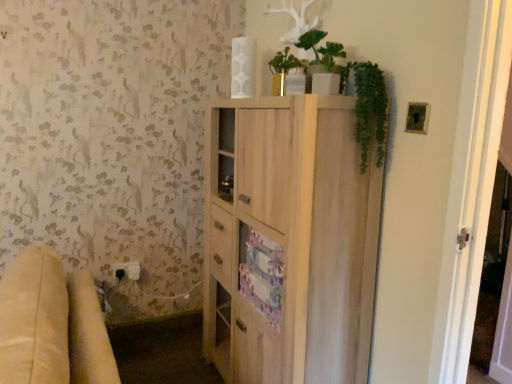
Question: Is green matte plant at upper center to the left or to the right of white plastic electric outlet at lower left in the image?

Choices:
 (A) left
 (B) right

Answer: (B)

Question: In terms of width, does green matte plant at upper center look wider or thinner when compared to white plastic electric outlet at lower left?

Choices:
 (A) wide
 (B) thin

Answer: (A)

Question: Estimate the real-world distances between objects in this image. Which object is closer to the beige fabric couch at lower left?

Choices:
 (A) green leafy plant at upper right
 (B) green matte plant at upper center
 (C) white plastic electric outlet at lower left
 (D) light wood cabinet at center

Answer: (D)

Question: Estimate the real-world distances between objects in this image. Which object is closer to the green leafy plant at upper right?

Choices:
 (A) white plastic electric outlet at lower left
 (B) green matte plant at upper center
 (C) light wood cabinet at center
 (D) beige fabric couch at lower left

Answer: (B)